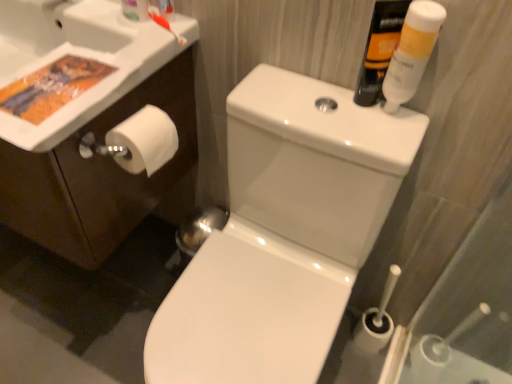
Question: Considering the positions of translucent plastic mouthwash at upper right, the second mouthwash when ordered from right to left, and orange plastic toothbrush at upper left in the image, is translucent plastic mouthwash at upper right, the second mouthwash when ordered from right to left, bigger or smaller than orange plastic toothbrush at upper left?

Choices:
 (A) small
 (B) big

Answer: (B)

Question: Considering the positions of translucent plastic mouthwash at upper right, the second mouthwash when ordered from right to left, and orange plastic toothbrush at upper left in the image, is translucent plastic mouthwash at upper right, the second mouthwash when ordered from right to left, wider or thinner than orange plastic toothbrush at upper left?

Choices:
 (A) thin
 (B) wide

Answer: (B)

Question: Which object is positioned closest to the white glossy toilet at center?

Choices:
 (A) white matte toilet paper at left
 (B) white glossy sink at upper left
 (C) white glossy tube at upper right, which appears as the second mouthwash when viewed from the left
 (D) translucent plastic toothbrush at upper left
 (E) orange plastic toothbrush at upper left

Answer: (A)

Question: Which object is positioned farthest from the translucent plastic toothbrush at upper left?

Choices:
 (A) translucent plastic mouthwash at upper right, the second mouthwash when ordered from right to left
 (B) white glossy tube at upper right, acting as the first mouthwash starting from the right
 (C) white matte toilet paper at left
 (D) white glossy toilet at center
 (E) white glossy sink at upper left

Answer: (D)